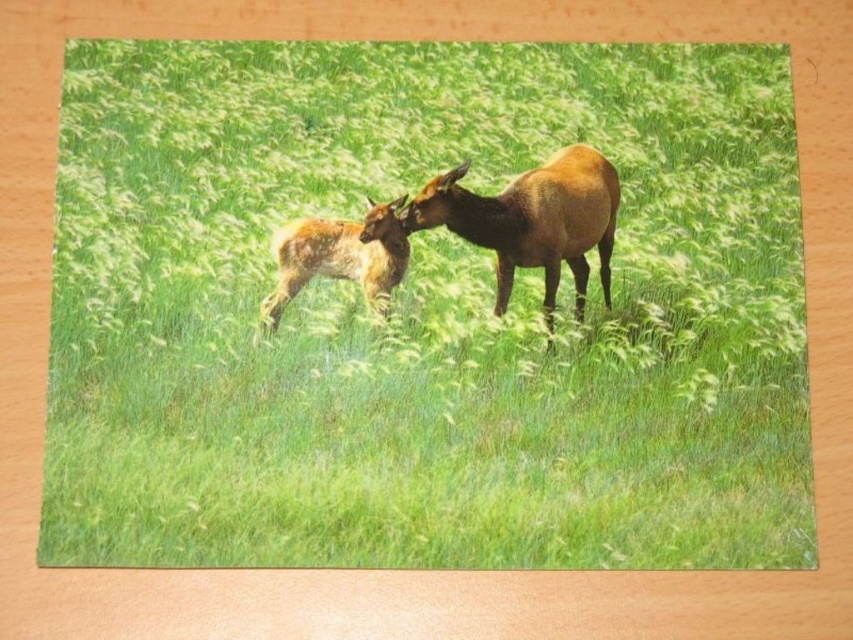
You are a wildlife photographer aiming to capture both the brown glossy deer at center and the spotted fur deer at center in a single frame. Your camera has a maximum focus range of 10 inches. Can you fit both deer into your camera frame without moving closer?

The brown glossy deer at center is 11.06 inches away from the spotted fur deer at center. Since the distance between them exceeds the camera maximum focus range of 10 inches, you cannot fit both deer into the camera frame without moving closer.

You are a wildlife photographer aiming to capture both the brown glossy deer at center and the spotted fur deer at center in a single frame. Based on their sizes, which deer should you focus on first to ensure both fit in the shot?

The brown glossy deer at center is taller than the spotted fur deer at center, so you should focus on the brown glossy deer at center first to account for its larger size and ensure both fit in the frame.